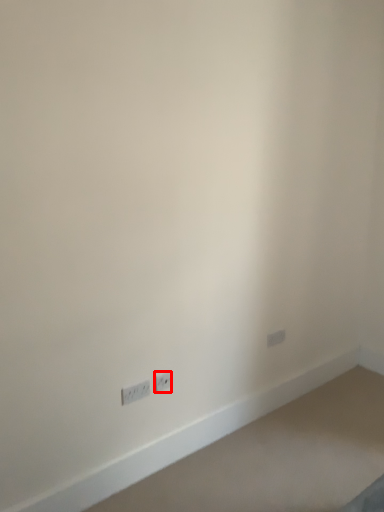
Question: From the image's perspective, where is power plugs and sockets (annotated by the red box) located relative to power plugs and sockets?

Choices:
 (A) above
 (B) below

Answer: (A)